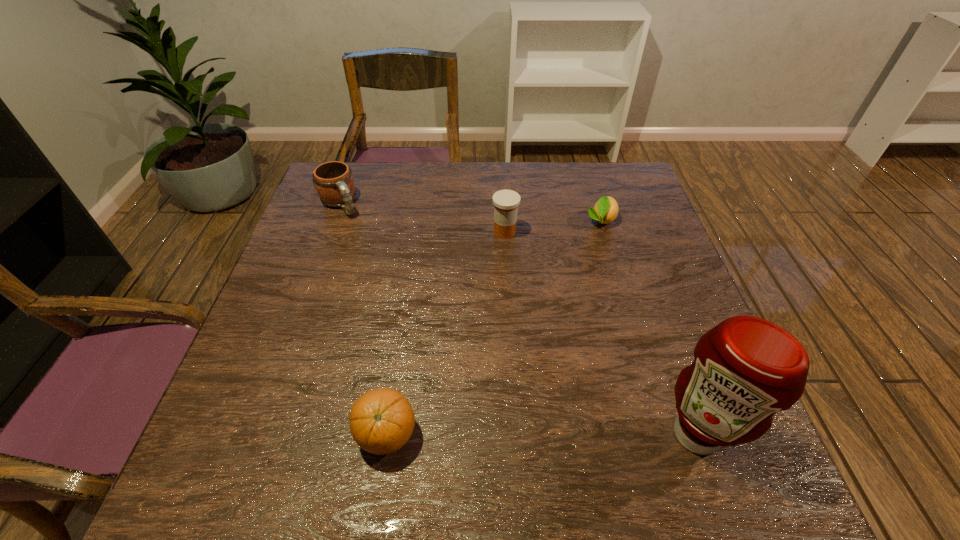
Locate an element on the screen. The width and height of the screenshot is (960, 540). free space located on the side of the leftmost object with the handle is located at coordinates (399, 293).

At what (x,y) coordinates should I click in order to perform the action: click on vacant position located on the side of the leftmost object with the handle. Please return your answer as a coordinate pair (x, y). The image size is (960, 540). Looking at the image, I should click on (409, 307).

In order to click on vacant space located on the side of the leftmost object with the handle in this screenshot , I will do `click(393, 283)`.

Identify the location of free space located with leaves positioned above the shortest object. pyautogui.click(x=570, y=325).

This screenshot has width=960, height=540. I want to click on free location located 0.170m with leaves positioned above the shortest object, so pos(587,274).

Where is `free space located with leaves positioned above the shortest object`? Image resolution: width=960 pixels, height=540 pixels. free space located with leaves positioned above the shortest object is located at coordinates (585, 279).

This screenshot has width=960, height=540. In order to click on object present at the far edge in this screenshot , I will do `click(334, 183)`.

This screenshot has width=960, height=540. I want to click on orange present at the near edge, so click(x=382, y=420).

You are a GUI agent. You are given a task and a screenshot of the screen. Output one action in this format:
    pyautogui.click(x=<x>, y=<y>)
    Task: Click on the condiment located in the near edge section of the desktop
    The width and height of the screenshot is (960, 540).
    Given the screenshot: What is the action you would take?
    pyautogui.click(x=745, y=369)

You are a GUI agent. You are given a task and a screenshot of the screen. Output one action in this format:
    pyautogui.click(x=<x>, y=<y>)
    Task: Click on the object at the left edge
    
    Given the screenshot: What is the action you would take?
    pyautogui.click(x=334, y=183)